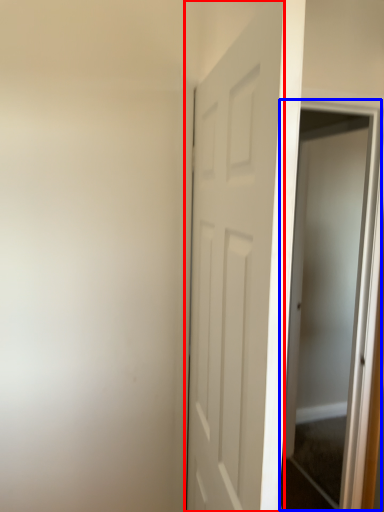
Question: Which object appears closest to the camera in this image, door (highlighted by a red box) or screen door (highlighted by a blue box)?

Choices:
 (A) door
 (B) screen door

Answer: (A)